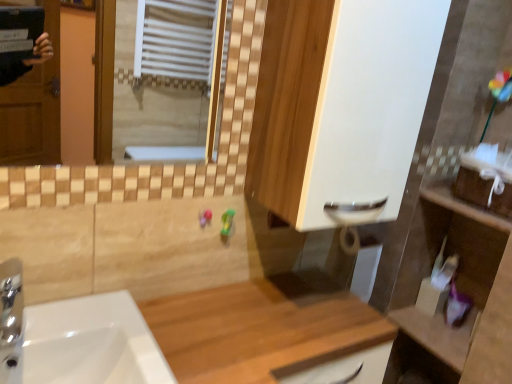
Where is `vacant space situated above wooden at center (from a real-world perspective)`? The width and height of the screenshot is (512, 384). vacant space situated above wooden at center (from a real-world perspective) is located at coordinates (241, 328).